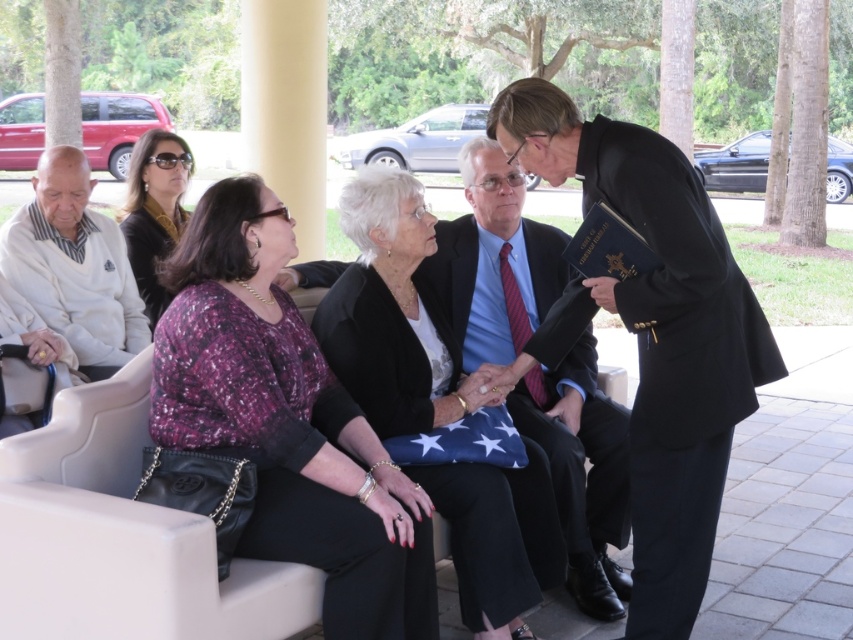
You are a photographer at the event and need to adjust the lighting so that both the black suit at center and the satin black dress at upper left are well lit. Which object should you focus on first to ensure proper exposure?

The black suit at center should be focused on first because it is positioned under the satin black dress at upper left, meaning it might be in a shadowed area requiring more light.

You are a photographer standing at the camera position. You need to take a photo of the black suit at right, but you want to ensure you are within the 3 meter range of your camera lens to get a clear shot. Can you confirm if you are within the required distance?

The distance between the black suit at right and the camera is 2.64 meters, which is within the 3 meter range, so you can take a clear photo.

You are a photographer positioned behind the black suit at right and the black satin blazer at center. Which one is closer to you?

The black suit at right is closer to you because it is in front of the black satin blazer at center.